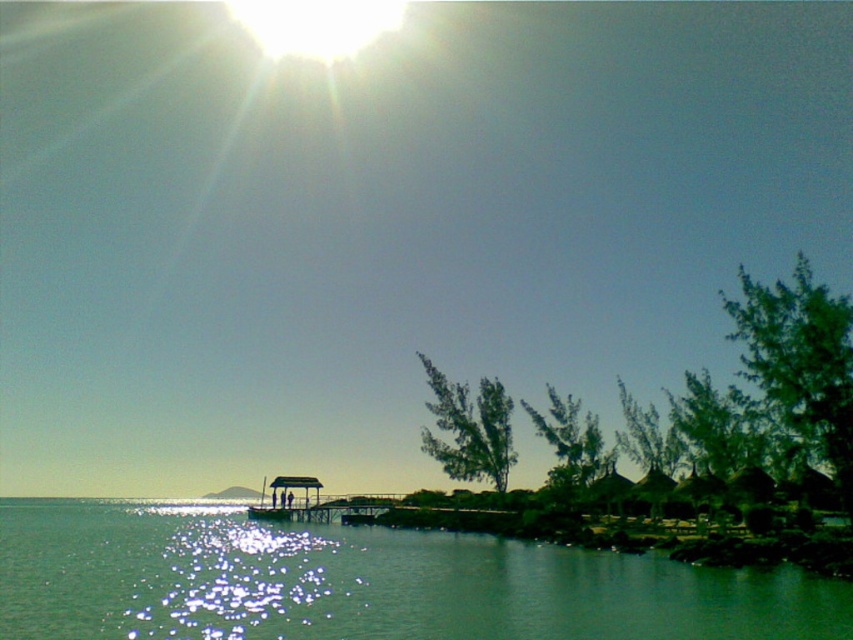
Question: Is green glossy water at center bigger than wooden pier at center?

Choices:
 (A) yes
 (B) no

Answer: (A)

Question: Is green glossy water at center smaller than wooden pier at center?

Choices:
 (A) yes
 (B) no

Answer: (B)

Question: Is green glossy water at center further to camera compared to wooden pier at center?

Choices:
 (A) no
 (B) yes

Answer: (A)

Question: Which of the following is the closest to the observer?

Choices:
 (A) green glossy water at center
 (B) wooden pier at center

Answer: (A)